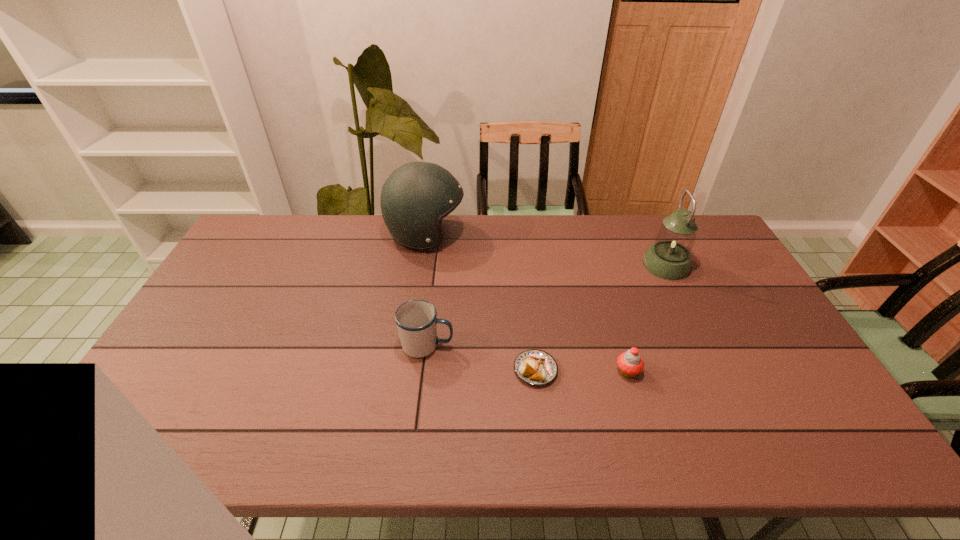
The height and width of the screenshot is (540, 960). I want to click on blank space at the far right corner of the desktop, so click(699, 232).

This screenshot has width=960, height=540. In order to click on free space that is in between the pastry and the cupcake in this screenshot , I will do `click(582, 370)`.

Locate an element on the screen. vacant area that lies between the cupcake and the shortest object is located at coordinates (582, 370).

Find the location of `vacant area that lies between the mug and the rightmost object`. vacant area that lies between the mug and the rightmost object is located at coordinates (546, 305).

Identify the location of free space that is in between the rightmost object and the mug. pyautogui.click(x=546, y=305).

I want to click on free area in between the shortest object and the football helmet, so tap(481, 302).

Where is `free space between the mug and the lantern`? free space between the mug and the lantern is located at coordinates (546, 305).

The height and width of the screenshot is (540, 960). I want to click on vacant area that lies between the third object from left to right and the mug, so click(x=481, y=357).

Where is `free space between the football helmet and the lantern`? The height and width of the screenshot is (540, 960). free space between the football helmet and the lantern is located at coordinates (546, 250).

What are the coordinates of `free spot between the football helmet and the pastry` in the screenshot? It's located at (481, 302).